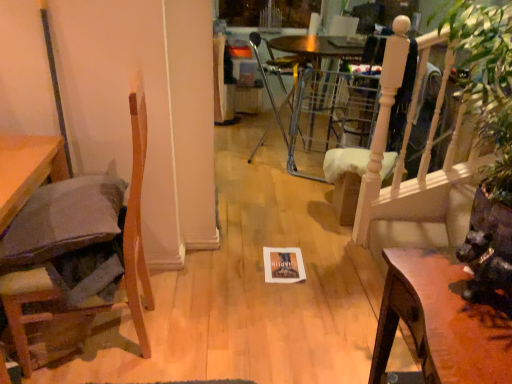
Image resolution: width=512 pixels, height=384 pixels. Find the location of `metallic silver chair at center, which is counted as the second chair, starting from the bottom`. metallic silver chair at center, which is counted as the second chair, starting from the bottom is located at coordinates (278, 76).

Locate an element on the screen. metallic silver chair at center, which is the first chair in right-to-left order is located at coordinates (278, 76).

Could you measure the distance between gray fabric pillow at left and metallic silver chair at center, positioned as the 2th chair in front-to-back order?

A distance of 6.62 feet exists between gray fabric pillow at left and metallic silver chair at center, positioned as the 2th chair in front-to-back order.

Is point (83, 245) in front of point (292, 107)?

Yes, point (83, 245) is closer to viewer.

Is gray fabric pillow at left far from metallic silver chair at center, positioned as the 2th chair in front-to-back order?

Yes.

Considering the relative sizes of gray fabric pillow at left and metallic silver chair at center, which is counted as the second chair, starting from the bottom, in the image provided, is gray fabric pillow at left smaller than metallic silver chair at center, which is counted as the second chair, starting from the bottom,?

Correct, gray fabric pillow at left occupies less space than metallic silver chair at center, which is counted as the second chair, starting from the bottom.

Is gray fabric pillow at left spatially inside wooden table at lower right, or outside of it?

The correct answer is: outside.

Is gray fabric pillow at left positioned in front of wooden table at lower right?

No.

Is there a large distance between gray fabric pillow at left and wooden table at lower right?

Indeed, gray fabric pillow at left is not near wooden table at lower right.

From the image's perspective, between wooden chair at left, which is counted as the 2th chair, starting from the right, and metallic silver chair at center, positioned as the first chair in top-to-bottom order, who is located below?

From the image's view, wooden chair at left, which is counted as the 2th chair, starting from the right, is below.

Is wooden chair at left, which is counted as the 2th chair, starting from the right, inside or outside of metallic silver chair at center, positioned as the first chair in top-to-bottom order?

wooden chair at left, which is counted as the 2th chair, starting from the right, is not enclosed by metallic silver chair at center, positioned as the first chair in top-to-bottom order.

Is wooden chair at left, marked as the 1th chair in a front-to-back arrangement, not close to metallic silver chair at center, marked as the 2th chair in a left-to-right arrangement?

Indeed, wooden chair at left, marked as the 1th chair in a front-to-back arrangement, is not near metallic silver chair at center, marked as the 2th chair in a left-to-right arrangement.

Which of these two, wooden chair at left, the 1th chair in the bottom-to-top sequence, or metallic silver chair at center, which is counted as the second chair, starting from the bottom, is thinner?

Thinner between the two is metallic silver chair at center, which is counted as the second chair, starting from the bottom.

Is point (280, 128) farther from viewer compared to point (81, 312)?

Yes, it is behind point (81, 312).

In the scene shown: Considering the sizes of objects metallic silver chair at center, which is the first chair in right-to-left order, and wooden chair at left, which is counted as the 2th chair, starting from the right, in the image provided, who is smaller, metallic silver chair at center, which is the first chair in right-to-left order, or wooden chair at left, which is counted as the 2th chair, starting from the right,?

metallic silver chair at center, which is the first chair in right-to-left order.

Does metallic silver chair at center, positioned as the 2th chair in front-to-back order, appear on the right side of wooden chair at left, marked as the 1th chair in a left-to-right arrangement?

Yes, metallic silver chair at center, positioned as the 2th chair in front-to-back order, is to the right of wooden chair at left, marked as the 1th chair in a left-to-right arrangement.

Is metallic silver chair at center, positioned as the 2th chair in front-to-back order, touching wooden chair at left, the 2th chair from the back?

No, metallic silver chair at center, positioned as the 2th chair in front-to-back order, is not beside wooden chair at left, the 2th chair from the back.

This screenshot has width=512, height=384. What are the coordinates of `table on the right of wooden chair at left, the 2th chair from the back` in the screenshot? It's located at (440, 322).

Is wooden table at lower right inside wooden chair at left, the 1th chair in the bottom-to-top sequence?

No, wooden chair at left, the 1th chair in the bottom-to-top sequence, does not contain wooden table at lower right.

Is point (136, 230) closer or farther from the camera than point (488, 360)?

Point (136, 230) is positioned farther from the camera compared to point (488, 360).

Is wooden chair at left, which is counted as the 2th chair, starting from the right, facing away from wooden table at lower right?

wooden chair at left, which is counted as the 2th chair, starting from the right, is not turned away from wooden table at lower right.

Could you tell me if wooden table at lower right is turned towards gray fabric pillow at left?

No.

Does wooden table at lower right have a lesser height compared to gray fabric pillow at left?

No, wooden table at lower right is not shorter than gray fabric pillow at left.

What's the angular difference between wooden table at lower right and gray fabric pillow at left's facing directions?

They differ by 10.9 degrees in their facing directions.

The width and height of the screenshot is (512, 384). What are the coordinates of `pillow lying above the wooden table at lower right (from the image's perspective)` in the screenshot? It's located at (63, 220).

Considering the positions of points (381, 348) and (126, 233), is point (381, 348) farther from camera compared to point (126, 233)?

No, (381, 348) is closer to viewer.

Looking at this image, is wooden table at lower right looking in the opposite direction of wooden chair at left, the 2th chair in the top-to-bottom sequence?

wooden table at lower right is not turned away from wooden chair at left, the 2th chair in the top-to-bottom sequence.

From the image's perspective, count 1st chairs upward from the wooden table at lower right and point to it. Please provide its 2D coordinates.

[(123, 256)]

I want to click on pillow below the metallic silver chair at center, which is counted as the second chair, starting from the bottom (from the image's perspective), so point(63,220).

Image resolution: width=512 pixels, height=384 pixels. In order to click on pillow behind the wooden table at lower right in this screenshot , I will do `click(63, 220)`.

Which object lies further to the anchor point wooden table at lower right, gray fabric pillow at left or metallic silver chair at center, which is the first chair in right-to-left order?

Among the two, metallic silver chair at center, which is the first chair in right-to-left order, is located further to wooden table at lower right.

Estimate the real-world distances between objects in this image. Which object is further from gray fabric pillow at left, metallic silver chair at center, which is the first chair in right-to-left order, or wooden chair at left, the 2th chair in the top-to-bottom sequence?

Among the two, metallic silver chair at center, which is the first chair in right-to-left order, is located further to gray fabric pillow at left.

Estimate the real-world distances between objects in this image. Which object is further from wooden chair at left, the 2th chair from the back, metallic silver chair at center, which appears as the first chair when viewed from the back, or gray fabric pillow at left?

metallic silver chair at center, which appears as the first chair when viewed from the back, is further to wooden chair at left, the 2th chair from the back.

From the image, which object appears to be nearer to wooden table at lower right, gray fabric pillow at left or wooden chair at left, the 1th chair in the bottom-to-top sequence?

The object closer to wooden table at lower right is wooden chair at left, the 1th chair in the bottom-to-top sequence.

From the image, which object appears to be nearer to gray fabric pillow at left, wooden chair at left, which is counted as the 2th chair, starting from the right, or wooden table at lower right?

Among the two, wooden chair at left, which is counted as the 2th chair, starting from the right, is located nearer to gray fabric pillow at left.

Based on their spatial positions, is gray fabric pillow at left or wooden chair at left, which is counted as the 2th chair, starting from the right, further from metallic silver chair at center, which appears as the first chair when viewed from the back?

gray fabric pillow at left.

Estimate the real-world distances between objects in this image. Which object is closer to gray fabric pillow at left, wooden chair at left, the 1th chair in the bottom-to-top sequence, or metallic silver chair at center, which is the first chair in right-to-left order?

The object closer to gray fabric pillow at left is wooden chair at left, the 1th chair in the bottom-to-top sequence.

Based on their spatial positions, is metallic silver chair at center, marked as the 2th chair in a left-to-right arrangement, or wooden chair at left, marked as the 1th chair in a front-to-back arrangement, further from wooden table at lower right?

metallic silver chair at center, marked as the 2th chair in a left-to-right arrangement, lies further to wooden table at lower right than the other object.

At what (x,y) coordinates should I click in order to perform the action: click on pillow between wooden chair at left, marked as the 1th chair in a front-to-back arrangement, and metallic silver chair at center, which appears as the first chair when viewed from the back, in the front-back direction. Please return your answer as a coordinate pair (x, y). This screenshot has width=512, height=384. Looking at the image, I should click on (63, 220).

I want to click on pillow located between wooden table at lower right and metallic silver chair at center, marked as the 2th chair in a left-to-right arrangement, in the depth direction, so click(x=63, y=220).

The image size is (512, 384). Find the location of `chair between wooden table at lower right and metallic silver chair at center, positioned as the 2th chair in front-to-back order, in the front-back direction`. chair between wooden table at lower right and metallic silver chair at center, positioned as the 2th chair in front-to-back order, in the front-back direction is located at coordinates (123, 256).